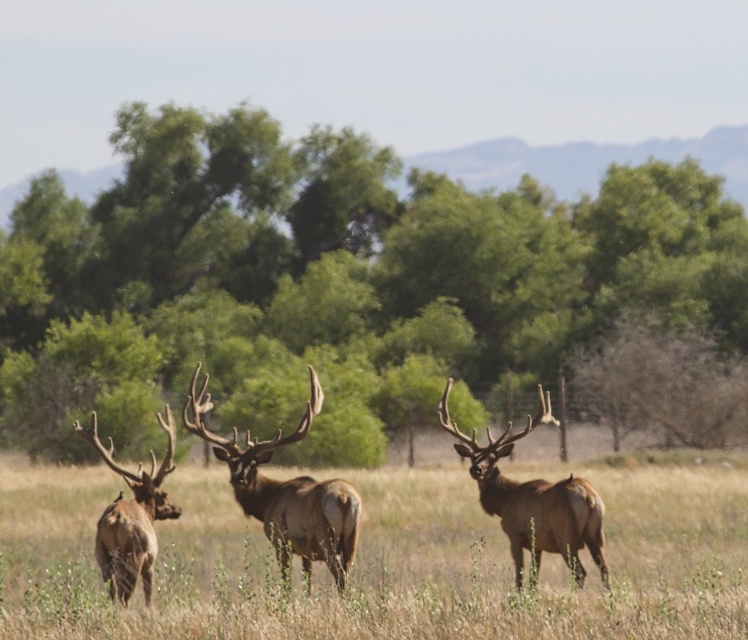
You are an archer aiming to hit a target located at one of the two points in the scene. The points are point (x=562, y=268) and point (x=123, y=472). Which point is closer to you, the archer, so you can aim more accurately?

Point (x=562, y=268) is further to the viewer than point (x=123, y=472), so the closer point to aim at is point (x=123, y=472).

You are a photographer trying to capture a closeup of the elk in the foreground. You notice two points marked in the image. Which point, point (197,433) or point (597,515), is closer to your camera?

Point (197,433) is closer to the camera than point (597,515).